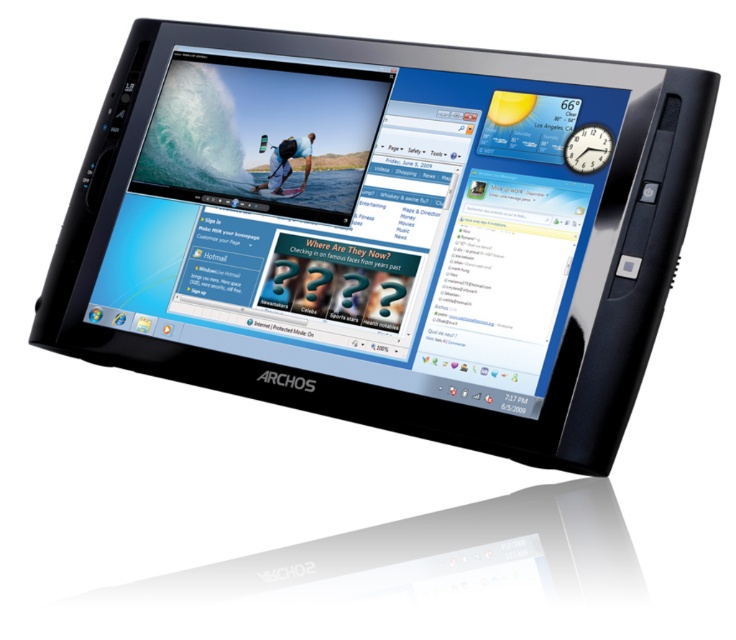
Question: Can you confirm if black plastic tablet at center is wider than matte black tablet at center?

Choices:
 (A) yes
 (B) no

Answer: (A)

Question: Is black plastic tablet at center wider than matte black tablet at center?

Choices:
 (A) no
 (B) yes

Answer: (B)

Question: Can you confirm if black plastic tablet at center is positioned below matte black tablet at center?

Choices:
 (A) no
 (B) yes

Answer: (B)